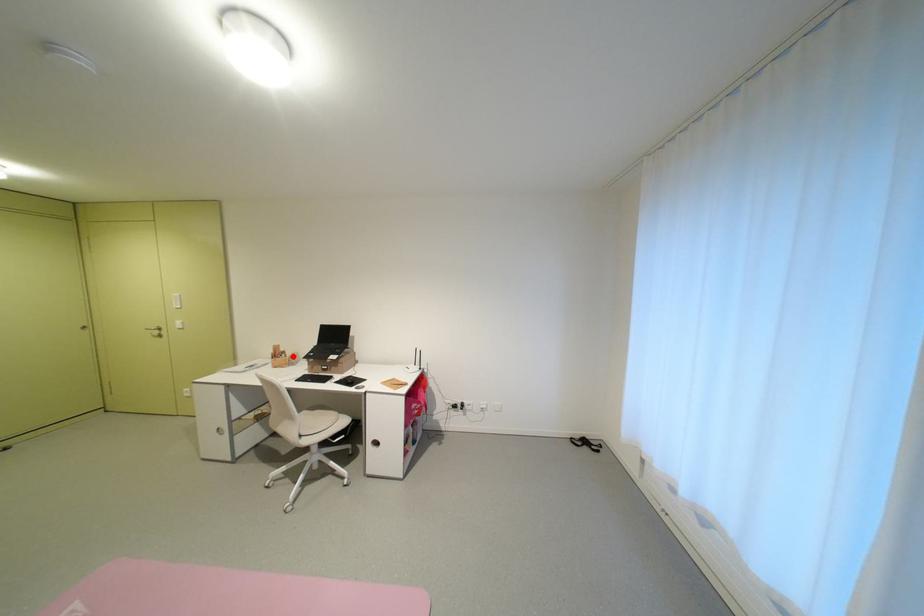
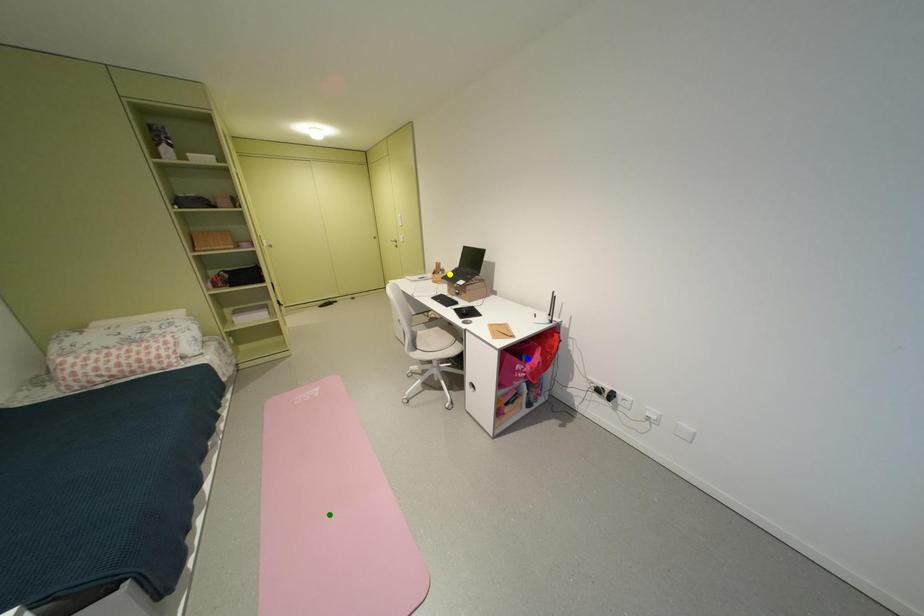
Question: I am providing you with two images of the same scene from different viewpoints. A red point is marked on the first image. You are given multiple points on the second image. Which mark in image 2 goes with the point in image 1?

Choices:
 (A) yellow point
 (B) blue point
 (C) green point

Answer: (A)